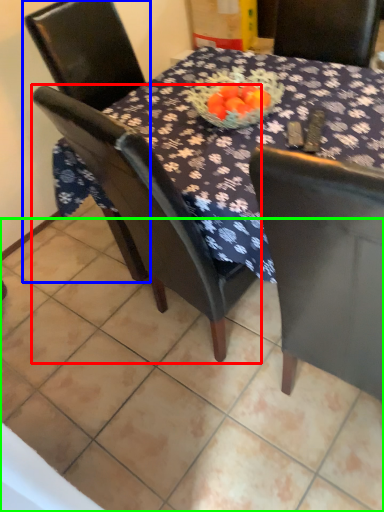
Question: Estimate the real-world distances between objects in this image. Which object is farther from chair (highlighted by a red box), chair (highlighted by a blue box) or tile (highlighted by a green box)?

Choices:
 (A) chair
 (B) tile

Answer: (A)